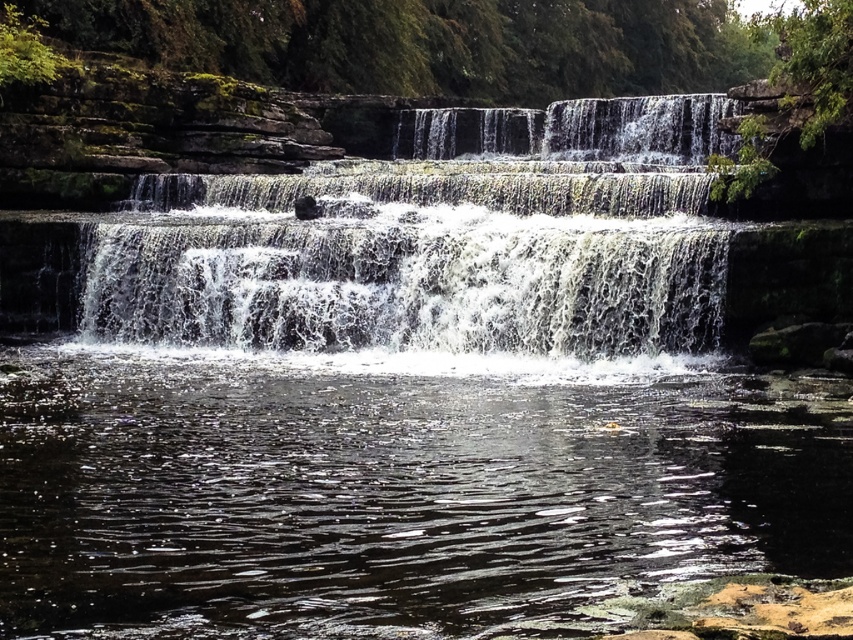
Question: Is white frothy water at center positioned behind white frothy water at upper center?

Choices:
 (A) yes
 (B) no

Answer: (B)

Question: Is clear water at center thinner than white frothy water at upper center?

Choices:
 (A) no
 (B) yes

Answer: (A)

Question: Which is nearer to the white frothy water at upper center?

Choices:
 (A) white frothy water at center
 (B) clear water at center

Answer: (A)

Question: In this image, where is white frothy water at center located relative to white frothy water at upper center?

Choices:
 (A) right
 (B) left

Answer: (B)

Question: Which point is closer to the camera?

Choices:
 (A) click(399, 195)
 (B) click(401, 132)
 (C) click(35, 564)

Answer: (C)

Question: Which point is farther from the camera taking this photo?

Choices:
 (A) (722, 108)
 (B) (245, 307)

Answer: (A)